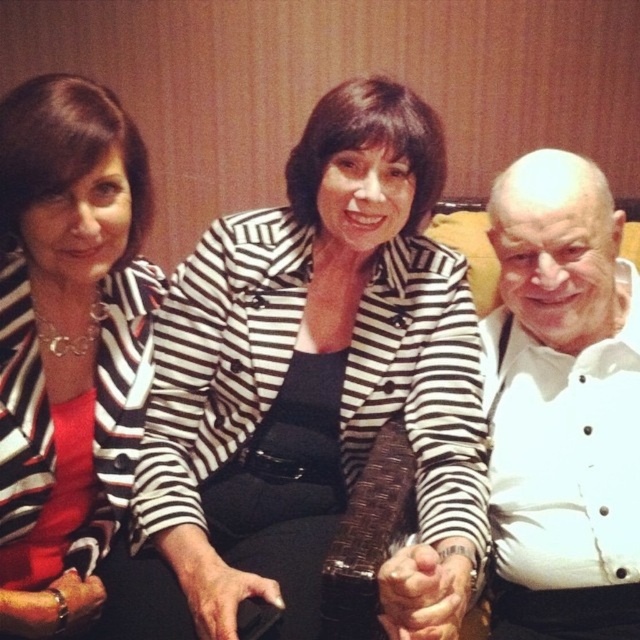
Question: Can you confirm if matte black blazer at upper left is smaller than white textured shirt at right?

Choices:
 (A) yes
 (B) no

Answer: (A)

Question: Is matte black blazer at upper left smaller than white textured shirt at right?

Choices:
 (A) yes
 (B) no

Answer: (A)

Question: Among these objects, which one is nearest to the camera?

Choices:
 (A) white textured shirt at right
 (B) matte black blazer at upper left

Answer: (B)

Question: Can you confirm if matte black blazer at upper left is bigger than white textured shirt at right?

Choices:
 (A) no
 (B) yes

Answer: (A)